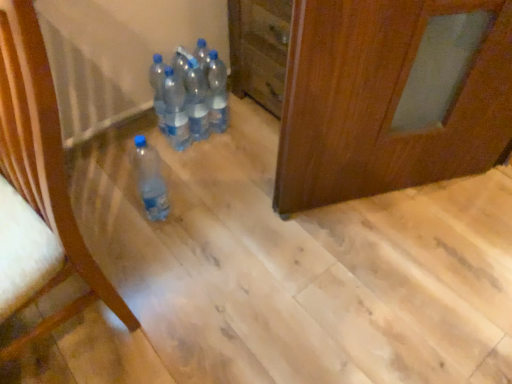
In order to click on spots to the right of translucent plastic bottles at center, placed as the 2th bottle when sorted from right to left in this screenshot , I will do `click(242, 138)`.